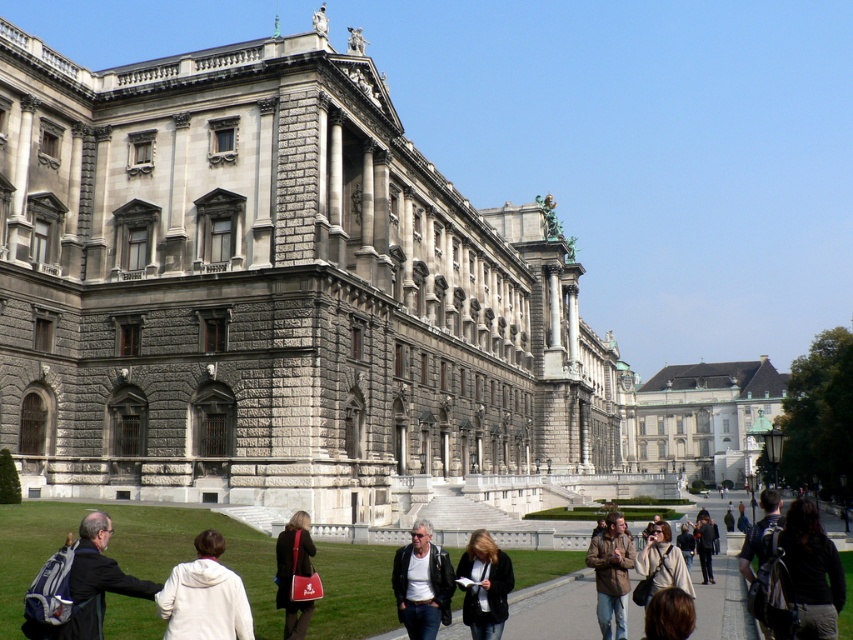
You are a tourist standing on the concrete pathway at center, and you see the green fabric backpack at lower right. Which direction should you move to reach the backpack?

The concrete pathway at center is located above the green fabric backpack at lower right, so you should move downward from the concrete pathway at center to reach the green fabric backpack at lower right.

From the picture: You are standing at point (811, 572) in the image. What object is located at your current position?

The dark brown leather jacket at lower right is located at point (811, 572).